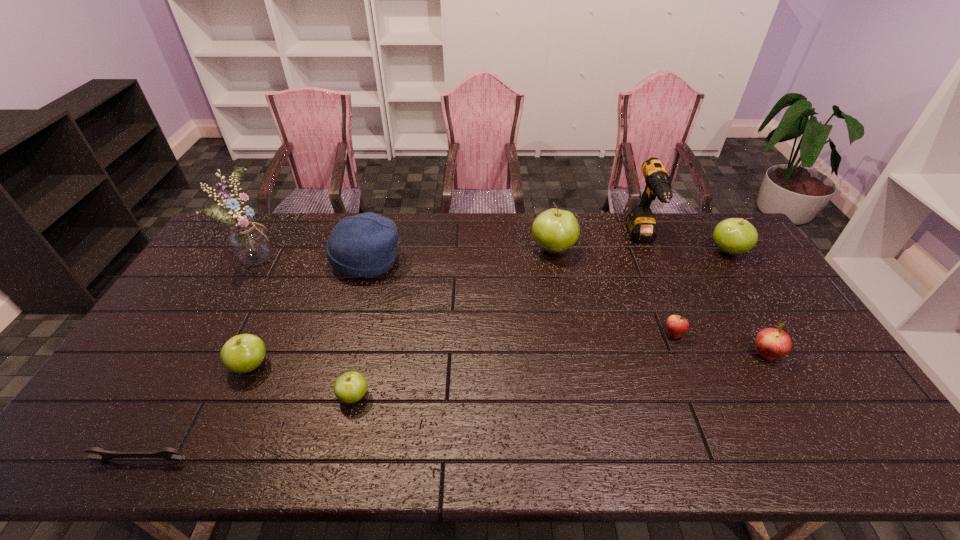
I want to click on free spot that satisfies the following two spatial constraints: 1. on the front side of the second apple from left to right; 2. on the left side of the skullcap, so click(328, 396).